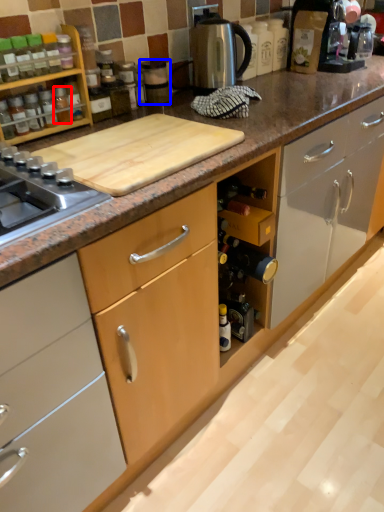
Question: Which object appears farthest to the camera in this image, bottle (highlighted by a red box) or appliance (highlighted by a blue box)?

Choices:
 (A) bottle
 (B) appliance

Answer: (B)